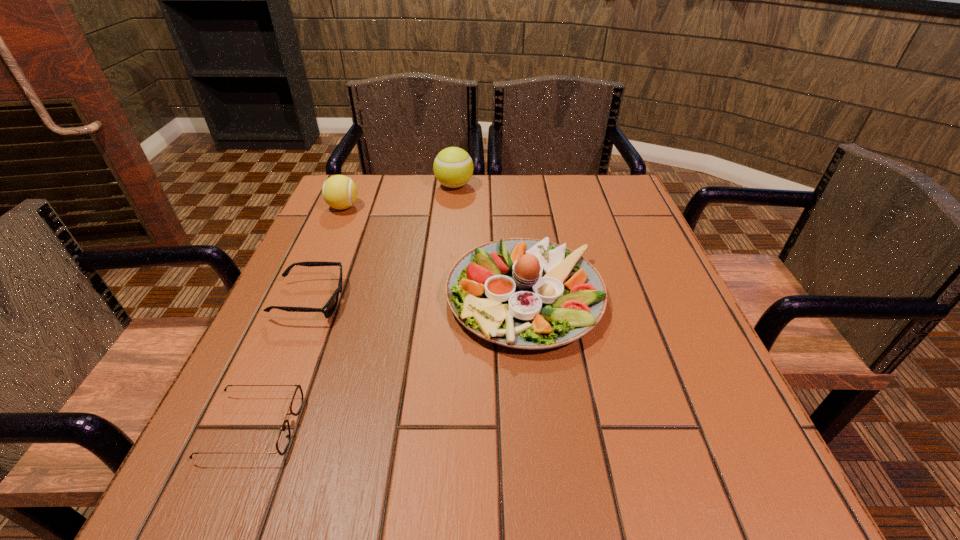
Locate an element on the screen. This screenshot has width=960, height=540. free space located 0.080m on the front of the fourth nearest object is located at coordinates (x=331, y=234).

In order to click on free space located 0.390m on the front-facing side of the farther sunglasses in this screenshot , I will do `click(536, 300)`.

Locate an element on the screen. free region located on the front-facing side of the nearest object is located at coordinates (508, 427).

I want to click on object that is at the near edge, so click(x=283, y=439).

You are a GUI agent. You are given a task and a screenshot of the screen. Output one action in this format:
    pyautogui.click(x=<x>, y=<y>)
    Task: Click on the tennis ball that is at the left edge
    
    Given the screenshot: What is the action you would take?
    pyautogui.click(x=340, y=192)

Find the location of a particular element. The height and width of the screenshot is (540, 960). object that is positioned at the right edge is located at coordinates (522, 293).

Find the location of `object that is at the far left corner`. object that is at the far left corner is located at coordinates (340, 192).

This screenshot has height=540, width=960. Identify the location of object situated at the near left corner. (283, 439).

This screenshot has height=540, width=960. I want to click on vacant area at the far edge, so click(x=473, y=201).

The width and height of the screenshot is (960, 540). In the image, there is a desktop. In order to click on vacant space at the near edge in this screenshot , I will do `click(572, 463)`.